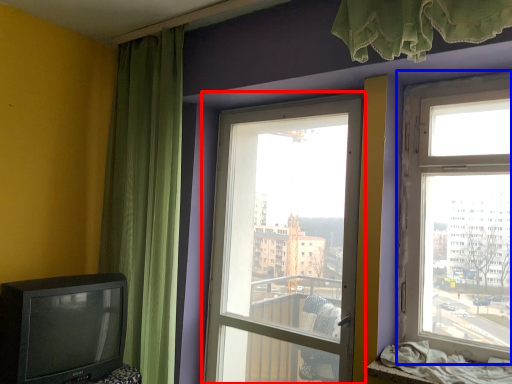
Question: Which object appears farthest to the camera in this image, window (highlighted by a red box) or window (highlighted by a blue box)?

Choices:
 (A) window
 (B) window

Answer: (A)